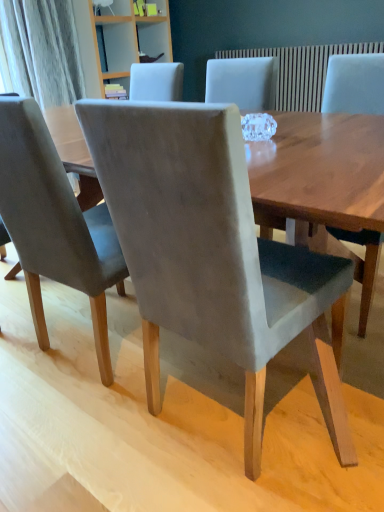
Question: Relative to suede gray chair at center, the second chair in the left-to-right sequence, is suede gray chair at center, the 1th chair viewed from the left, in front or behind?

Choices:
 (A) behind
 (B) front

Answer: (A)

Question: In terms of width, does suede gray chair at center, the 1th chair viewed from the left, look wider or thinner when compared to suede gray chair at center, the second chair in the left-to-right sequence?

Choices:
 (A) wide
 (B) thin

Answer: (A)

Question: Based on their relative distances, which object is farther from the suede gray chair at center, arranged as the 2th chair when viewed from the right?

Choices:
 (A) suede gray chair at center, the 1th chair viewed from the left
 (B) velvet gray chair at center, which is the 3th chair in left-to-right order

Answer: (B)

Question: Considering the real-world distances, which object is closest to the suede gray chair at center, arranged as the 2th chair when viewed from the right?

Choices:
 (A) velvet gray chair at center, the first chair from the right
 (B) suede gray chair at center, acting as the third chair starting from the right

Answer: (B)